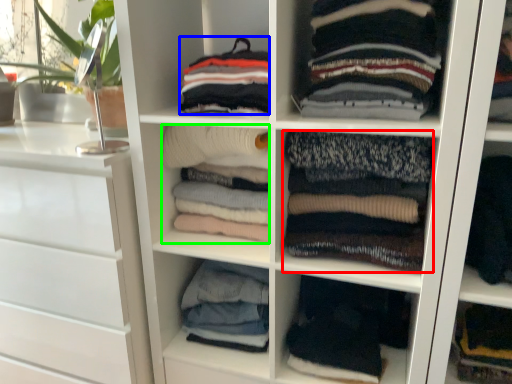
Question: Considering the real-world distances, which object is farthest from clothing (highlighted by a red box)? clothing (highlighted by a blue box) or clothing (highlighted by a green box)?

Choices:
 (A) clothing
 (B) clothing

Answer: (A)